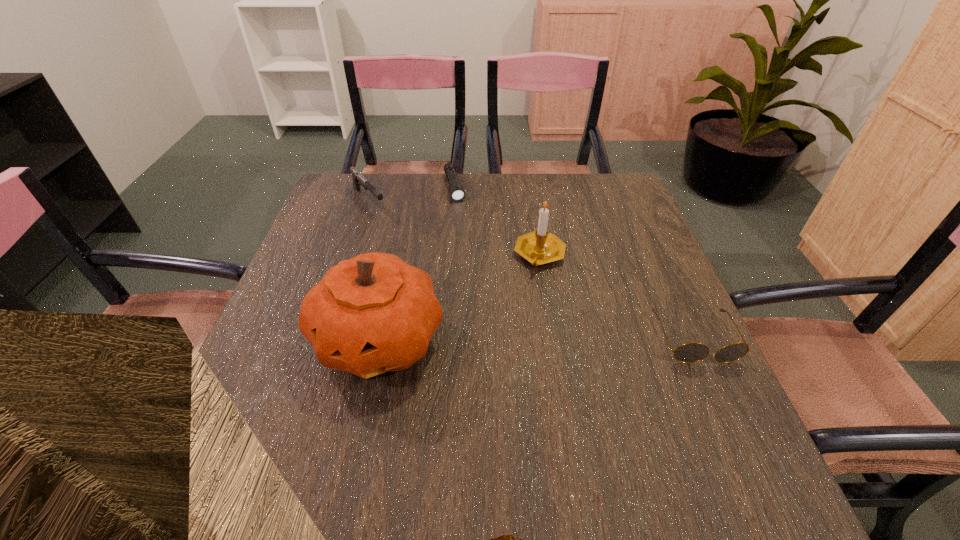
At what (x,y) coordinates should I click in order to perform the action: click on object that is the third closest one to the third nearest object. Please return your answer as a coordinate pair (x, y). Image resolution: width=960 pixels, height=540 pixels. Looking at the image, I should click on (457, 193).